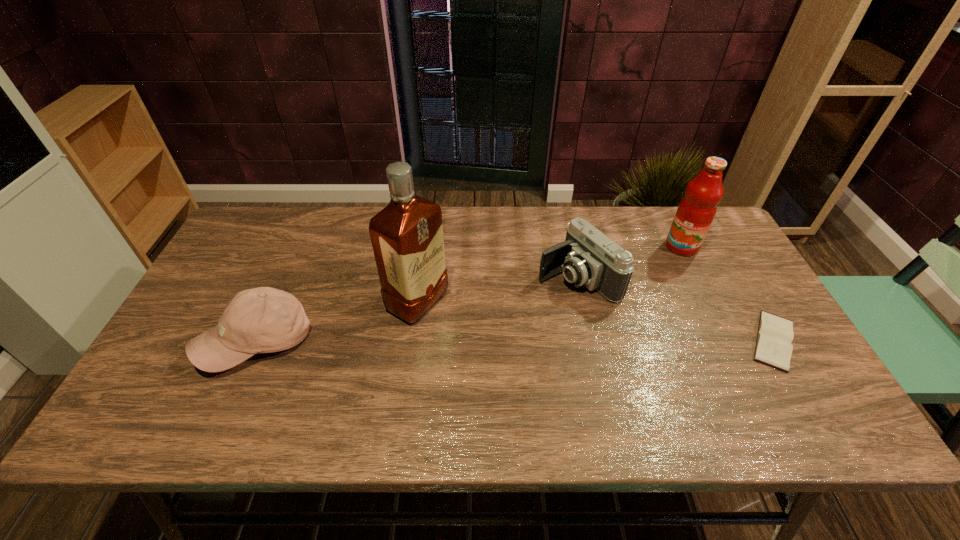
Image resolution: width=960 pixels, height=540 pixels. I want to click on free space between the second object from left to right and the camera, so click(497, 290).

You are a GUI agent. You are given a task and a screenshot of the screen. Output one action in this format:
    pyautogui.click(x=<x>, y=<y>)
    Task: Click on the empty space between the tallest object and the leftmost object
    
    Given the screenshot: What is the action you would take?
    pyautogui.click(x=337, y=322)

Find the location of `free area in between the third object from right to left and the second object from left to right`. free area in between the third object from right to left and the second object from left to right is located at coordinates (497, 290).

Locate an element on the screen. The image size is (960, 540). free point between the diary and the fruit juice is located at coordinates (728, 294).

You are a GUI agent. You are given a task and a screenshot of the screen. Output one action in this format:
    pyautogui.click(x=<x>, y=<y>)
    Task: Click on the free space between the leftmost object and the liquor
    
    Given the screenshot: What is the action you would take?
    pyautogui.click(x=337, y=322)

Locate an element on the screen. The image size is (960, 540). vacant area that lies between the leftmost object and the second object from left to right is located at coordinates (337, 322).

Find the location of a particular element. The height and width of the screenshot is (540, 960). free space between the baseball cap and the shortest object is located at coordinates (516, 341).

The image size is (960, 540). Find the location of `object that is the closest to the tallest object`. object that is the closest to the tallest object is located at coordinates (261, 320).

Choose which object is the nearest neighbor to the fruit juice. Please provide its 2D coordinates. Your answer should be formatted as a tuple, i.e. [(x, y)], where the tuple contains the x and y coordinates of a point satisfying the conditions above.

[(588, 257)]

Where is `free spot that satisfies the following two spatial constraints: 1. on the front side of the second tallest object; 2. on the left side of the diary`? free spot that satisfies the following two spatial constraints: 1. on the front side of the second tallest object; 2. on the left side of the diary is located at coordinates [x=728, y=341].